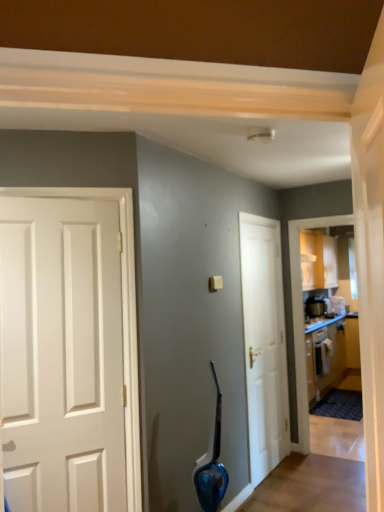
I want to click on free location to the right of white glossy door at center, so click(311, 472).